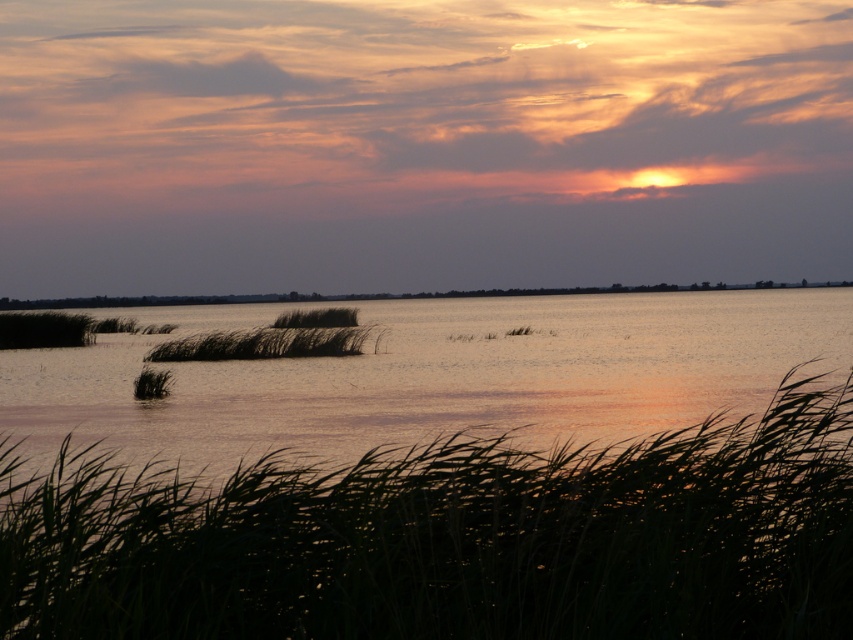
Question: Which of these objects is positioned farthest from the silvery grass at center?

Choices:
 (A) green grass at center
 (B) smooth water at center
 (C) silvery reeds at lower left

Answer: (B)

Question: Which of these objects is positioned closest to the green grass at center?

Choices:
 (A) silvery reeds at lower left
 (B) smooth water at center
 (C) silvery grass at center

Answer: (A)

Question: Is the position of green grass at center more distant than that of smooth water at center?

Choices:
 (A) no
 (B) yes

Answer: (A)

Question: Is the position of silvery reeds at lower left more distant than that of silvery grass at center?

Choices:
 (A) no
 (B) yes

Answer: (A)

Question: Is silvery reeds at lower left above smooth water at center?

Choices:
 (A) no
 (B) yes

Answer: (A)

Question: Which of the following is the closest to the observer?

Choices:
 (A) silvery grass at center
 (B) silvery reeds at lower left
 (C) smooth water at center

Answer: (B)